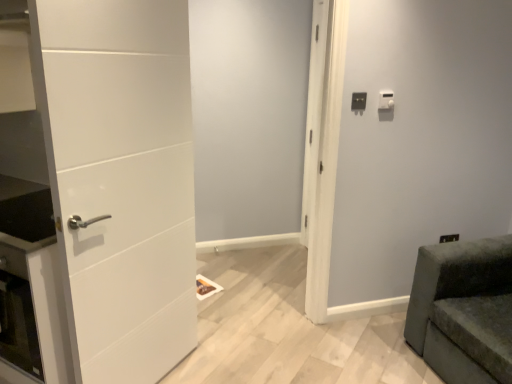
Question: From the image's perspective, is white plastic light switch at upper right, the 2th light switch viewed from the right, above or below white plastic light switch at upper right, positioned as the second light switch in left-to-right order?

Choices:
 (A) above
 (B) below

Answer: (B)

Question: Considering the positions of white plastic light switch at upper right, arranged as the 1th light switch when viewed from the left, and white plastic light switch at upper right, the 1th light switch viewed from the right, in the image, is white plastic light switch at upper right, arranged as the 1th light switch when viewed from the left, taller or shorter than white plastic light switch at upper right, the 1th light switch viewed from the right,?

Choices:
 (A) tall
 (B) short

Answer: (A)

Question: Which object is positioned closest to the white plastic light switch at upper right, the 1th light switch viewed from the right?

Choices:
 (A) velvet green sofa at lower right
 (B) white plastic light switch at upper right, arranged as the 1th light switch when viewed from the left
 (C) white matte door at left
 (D) white matte door at center

Answer: (B)

Question: Which object is the farthest from the white plastic light switch at upper right, positioned as the second light switch in left-to-right order?

Choices:
 (A) white matte door at left
 (B) white plastic light switch at upper right, the 2th light switch viewed from the right
 (C) velvet green sofa at lower right
 (D) white matte door at center

Answer: (A)